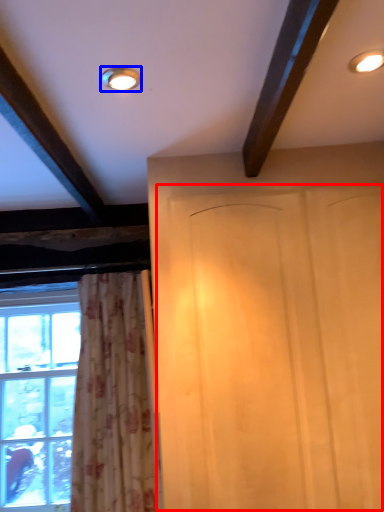
Question: Which point is closer to the camera, screen door (highlighted by a red box) or lighting (highlighted by a blue box)?

Choices:
 (A) screen door
 (B) lighting

Answer: (B)